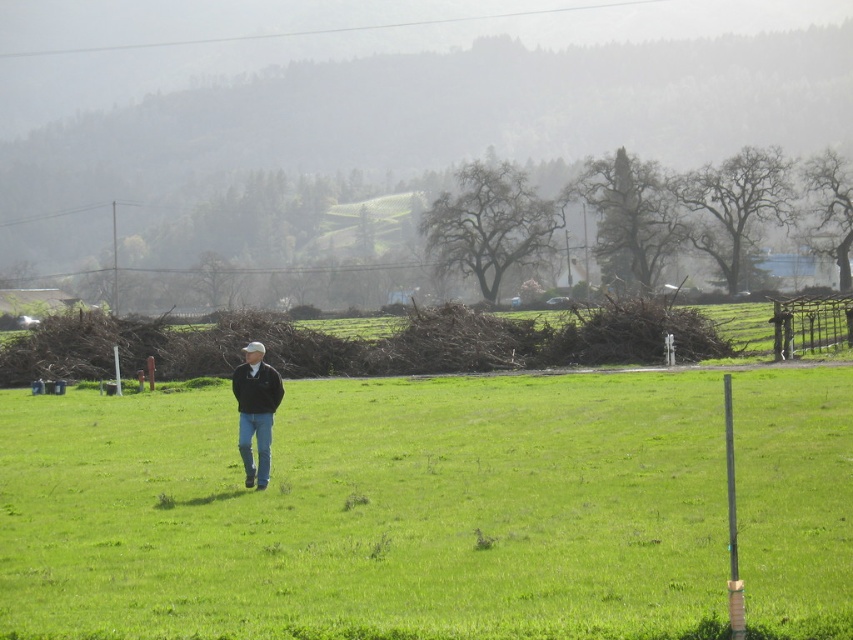
Question: Among these objects, which one is nearest to the camera?

Choices:
 (A) dark blue jeans at center
 (B) green grass at center

Answer: (B)

Question: Can you confirm if green grass at center is wider than dark blue jeans at center?

Choices:
 (A) yes
 (B) no

Answer: (A)

Question: Can you confirm if green grass at center is bigger than dark blue jeans at center?

Choices:
 (A) yes
 (B) no

Answer: (A)

Question: Which point is farther from the camera taking this photo?

Choices:
 (A) (244, 396)
 (B) (106, 541)

Answer: (A)

Question: Is green grass at center to the left of dark blue jeans at center from the viewer's perspective?

Choices:
 (A) yes
 (B) no

Answer: (B)

Question: Among these objects, which one is farthest from the camera?

Choices:
 (A) green grass at center
 (B) dark blue jeans at center

Answer: (B)